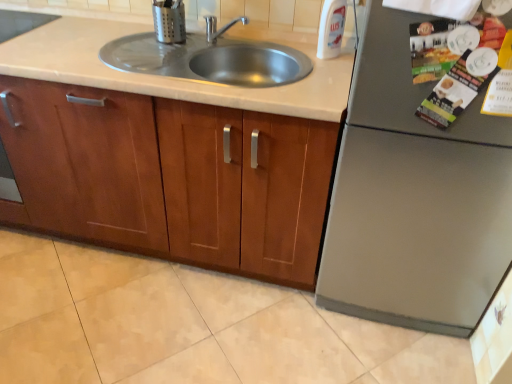
Question: Does stainless steel sink at center turn towards brushed metal utensil holder at upper center, the second appliance ordered from the bottom?

Choices:
 (A) yes
 (B) no

Answer: (B)

Question: Can you confirm if stainless steel sink at center is bigger than brushed metal utensil holder at upper center, the 2th appliance from the right?

Choices:
 (A) yes
 (B) no

Answer: (A)

Question: Considering the relative sizes of stainless steel sink at center and brushed metal utensil holder at upper center, the second appliance ordered from the bottom, in the image provided, is stainless steel sink at center shorter than brushed metal utensil holder at upper center, the second appliance ordered from the bottom,?

Choices:
 (A) yes
 (B) no

Answer: (B)

Question: Is stainless steel sink at center next to brushed metal utensil holder at upper center, the 2th appliance when ordered from front to back?

Choices:
 (A) yes
 (B) no

Answer: (B)

Question: Is stainless steel sink at center not within brushed metal utensil holder at upper center, the 2th appliance when ordered from front to back?

Choices:
 (A) no
 (B) yes

Answer: (B)

Question: In the image, is wooden cabinet at center positioned in front of or behind beige tile floor at lower center?

Choices:
 (A) behind
 (B) front

Answer: (A)

Question: From a real-world perspective, is wooden cabinet at center physically located above or below beige tile floor at lower center?

Choices:
 (A) below
 (B) above

Answer: (B)

Question: From the image's perspective, is wooden cabinet at center positioned above or below beige tile floor at lower center?

Choices:
 (A) below
 (B) above

Answer: (B)

Question: Does point (140, 105) appear closer or farther from the camera than point (376, 347)?

Choices:
 (A) closer
 (B) farther

Answer: (A)

Question: From a real-world perspective, is stainless steel sink at center positioned above or below brushed metal utensil holder at upper center, which is the 1th appliance from top to bottom?

Choices:
 (A) below
 (B) above

Answer: (A)

Question: Considering the positions of stainless steel sink at center and brushed metal utensil holder at upper center, which ranks as the 1th appliance in left-to-right order, in the image, is stainless steel sink at center taller or shorter than brushed metal utensil holder at upper center, which ranks as the 1th appliance in left-to-right order,?

Choices:
 (A) short
 (B) tall

Answer: (B)

Question: From the image's perspective, is stainless steel sink at center above or below brushed metal utensil holder at upper center, the 2th appliance when ordered from front to back?

Choices:
 (A) below
 (B) above

Answer: (A)

Question: Looking at their shapes, would you say stainless steel sink at center is wider or thinner than brushed metal utensil holder at upper center, which appears as the 1th appliance when viewed from the back?

Choices:
 (A) thin
 (B) wide

Answer: (B)

Question: In the image, is white plastic bottle at upper right positioned in front of or behind wooden cabinet at center?

Choices:
 (A) behind
 (B) front

Answer: (A)

Question: Would you say white plastic bottle at upper right is to the left or to the right of wooden cabinet at center in the picture?

Choices:
 (A) left
 (B) right

Answer: (B)